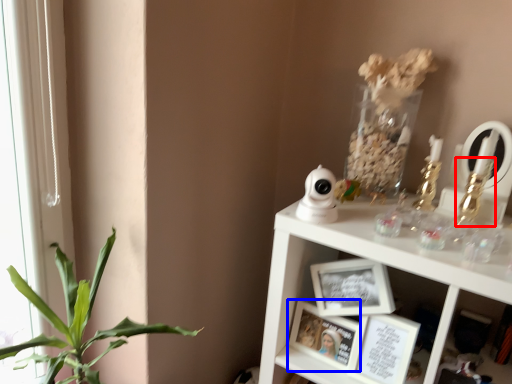
Question: Which object appears closest to the camera in this image, toy (highlighted by a red box) or picture frame (highlighted by a blue box)?

Choices:
 (A) toy
 (B) picture frame

Answer: (A)